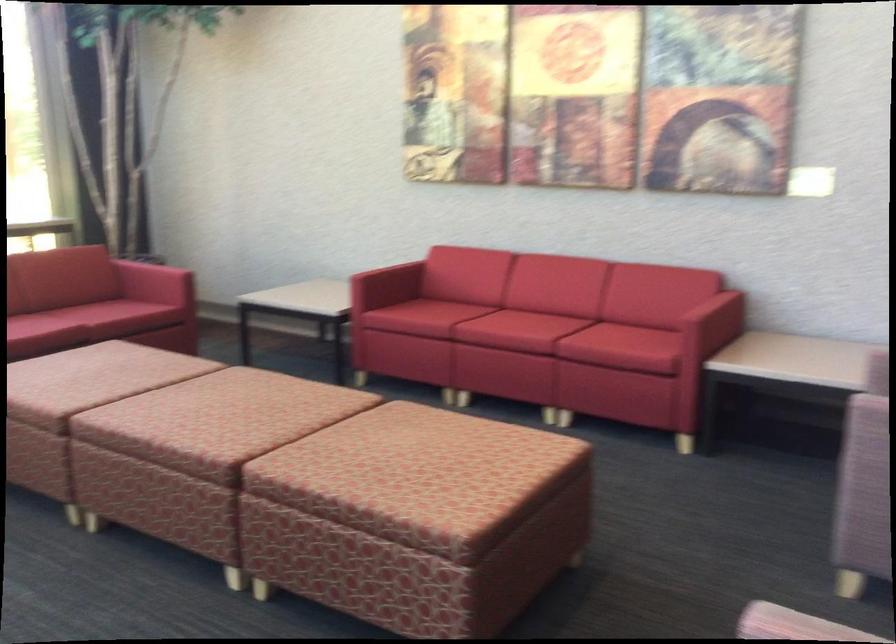
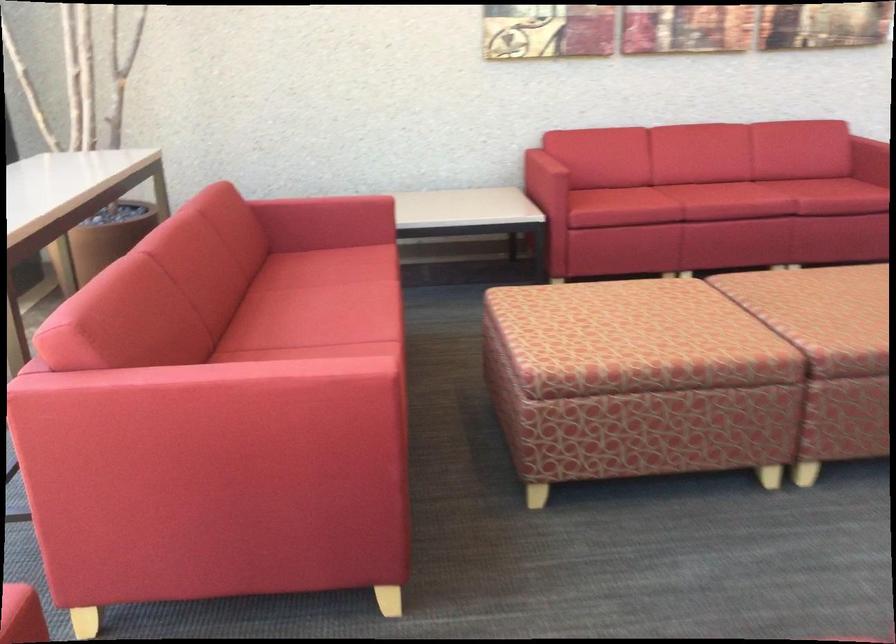
In the second image, find the point that corresponds to (x=148, y=269) in the first image.

(326, 207)